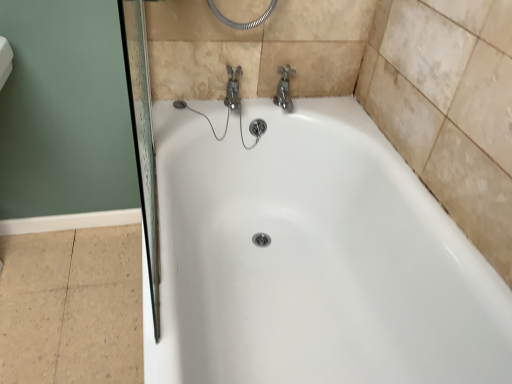
Locate an element on the screen. Image resolution: width=512 pixels, height=384 pixels. chrome metallic faucet at upper center is located at coordinates (284, 89).

Image resolution: width=512 pixels, height=384 pixels. What do you see at coordinates (284, 89) in the screenshot? I see `chrome metallic faucet at upper center` at bounding box center [284, 89].

What is the approximate height of chrome metallic faucet at upper center?

The height of chrome metallic faucet at upper center is 5.06 inches.

In the scene shown: In order to face white glossy bathtub at center, should I rotate leftwards or rightwards?

Turn right by 3.905 degrees to look at white glossy bathtub at center.

What is the approximate width of white glossy bathtub at center?

31.41 inches.

This screenshot has width=512, height=384. In order to click on white glossy bathtub at center in this screenshot , I will do `click(312, 259)`.

The width and height of the screenshot is (512, 384). What do you see at coordinates (312, 259) in the screenshot?
I see `white glossy bathtub at center` at bounding box center [312, 259].

The height and width of the screenshot is (384, 512). What are the coordinates of `chrome metallic faucet at upper center` in the screenshot? It's located at (284, 89).

Can you confirm if chrome metallic faucet at upper center is positioned to the right of white glossy bathtub at center?

Yes, chrome metallic faucet at upper center is to the right of white glossy bathtub at center.

Is the depth of chrome metallic faucet at upper center less than that of white glossy bathtub at center?

That is False.

Is point (286, 65) positioned before point (203, 252)?

That is False.

From the picture: From the image's perspective, is chrome metallic faucet at upper center positioned above or below white glossy bathtub at center?

Clearly, from the image's perspective, chrome metallic faucet at upper center is above white glossy bathtub at center.

From a real-world perspective, is chrome metallic faucet at upper center located beneath white glossy bathtub at center?

No.

Between chrome metallic faucet at upper center and white glossy bathtub at center, which one has smaller width?

With smaller width is chrome metallic faucet at upper center.

Does chrome metallic faucet at upper center have a lesser height compared to white glossy bathtub at center?

Yes.

Can you confirm if chrome metallic faucet at upper center is smaller than white glossy bathtub at center?

Yes, chrome metallic faucet at upper center is smaller than white glossy bathtub at center.

Is chrome metallic faucet at upper center surrounding white glossy bathtub at center?

Definitely not — white glossy bathtub at center is not inside chrome metallic faucet at upper center.

Is chrome metallic faucet at upper center with white glossy bathtub at center?

chrome metallic faucet at upper center is not next to white glossy bathtub at center, and they're not touching.

Is chrome metallic faucet at upper center aimed at white glossy bathtub at center?

No, chrome metallic faucet at upper center is not oriented towards white glossy bathtub at center.

How different are the orientations of chrome metallic faucet at upper center and white glossy bathtub at center in degrees?

The angle between the facing direction of chrome metallic faucet at upper center and the facing direction of white glossy bathtub at center is 90 degrees.

How far apart are chrome metallic faucet at upper center and white glossy bathtub at center?

A distance of 19.66 inches exists between chrome metallic faucet at upper center and white glossy bathtub at center.

Find the location of a particular element. This screenshot has width=512, height=384. bathtub that appears below the chrome metallic faucet at upper center (from the image's perspective) is located at coordinates (312, 259).

Which object is positioned more to the left, white glossy bathtub at center or chrome metallic faucet at upper center?

white glossy bathtub at center is more to the left.

Does white glossy bathtub at center come in front of chrome metallic faucet at upper center?

Yes, white glossy bathtub at center is closer to the camera.

Between point (226, 357) and point (293, 73), which one is positioned in front?

The point (226, 357) is closer.

From the image's perspective, is white glossy bathtub at center beneath chrome metallic faucet at upper center?

Yes, from the image's perspective, white glossy bathtub at center is below chrome metallic faucet at upper center.

From a real-world perspective, is white glossy bathtub at center under chrome metallic faucet at upper center?

Yes, from a real-world perspective, white glossy bathtub at center is under chrome metallic faucet at upper center.

Which object is wider, white glossy bathtub at center or chrome metallic faucet at upper center?

white glossy bathtub at center is wider.

Between white glossy bathtub at center and chrome metallic faucet at upper center, which one has less height?

chrome metallic faucet at upper center is shorter.

Which of these two, white glossy bathtub at center or chrome metallic faucet at upper center, is bigger?

Bigger between the two is white glossy bathtub at center.

Is chrome metallic faucet at upper center surrounded by white glossy bathtub at center?

That's incorrect, chrome metallic faucet at upper center is not inside white glossy bathtub at center.

Is white glossy bathtub at center next to chrome metallic faucet at upper center?

There is a gap between white glossy bathtub at center and chrome metallic faucet at upper center.

Is white glossy bathtub at center looking in the opposite direction of chrome metallic faucet at upper center?

That's not correct — white glossy bathtub at center is not looking away from chrome metallic faucet at upper center.

Can you tell me how much white glossy bathtub at center and chrome metallic faucet at upper center differ in facing direction?

The angular difference between white glossy bathtub at center and chrome metallic faucet at upper center is 90 degrees.

How distant is white glossy bathtub at center from chrome metallic faucet at upper center?

They are 19.66 inches apart.

Image resolution: width=512 pixels, height=384 pixels. What are the coordinates of `tap behind the white glossy bathtub at center` in the screenshot? It's located at (284, 89).

Locate an element on the screen. This screenshot has height=384, width=512. bathtub in front of the chrome metallic faucet at upper center is located at coordinates (312, 259).

The height and width of the screenshot is (384, 512). In order to click on bathtub on the left of the chrome metallic faucet at upper center in this screenshot , I will do `click(312, 259)`.